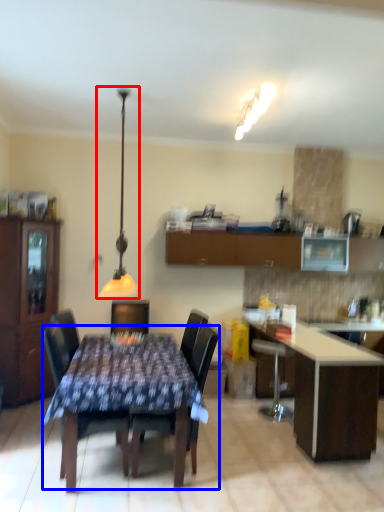
Question: Among these objects, which one is farthest to the camera, lamp (highlighted by a red box) or kitchen & dining room table (highlighted by a blue box)?

Choices:
 (A) lamp
 (B) kitchen & dining room table

Answer: (A)